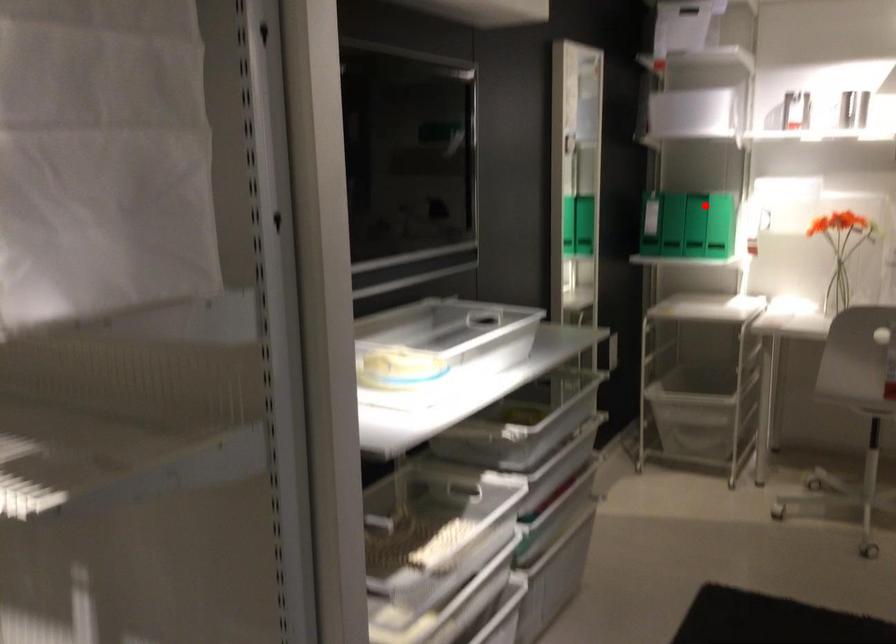
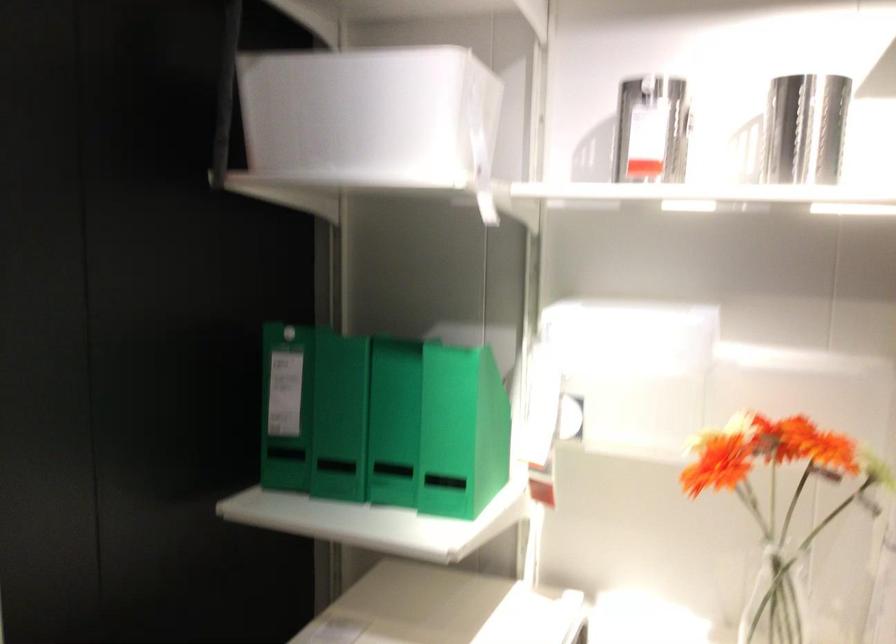
Locate, in the second image, the point that corresponds to the highlighted location in the first image.

(339, 417)